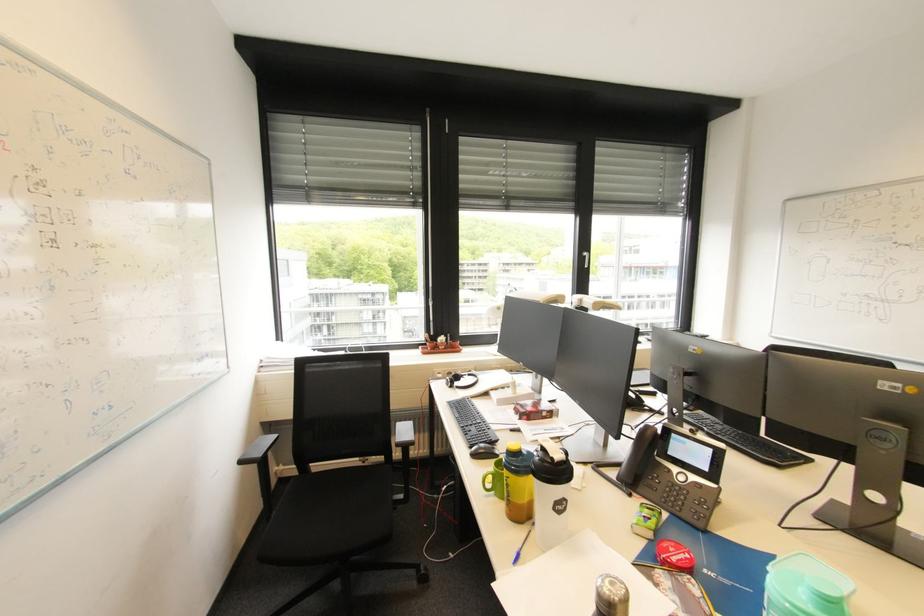
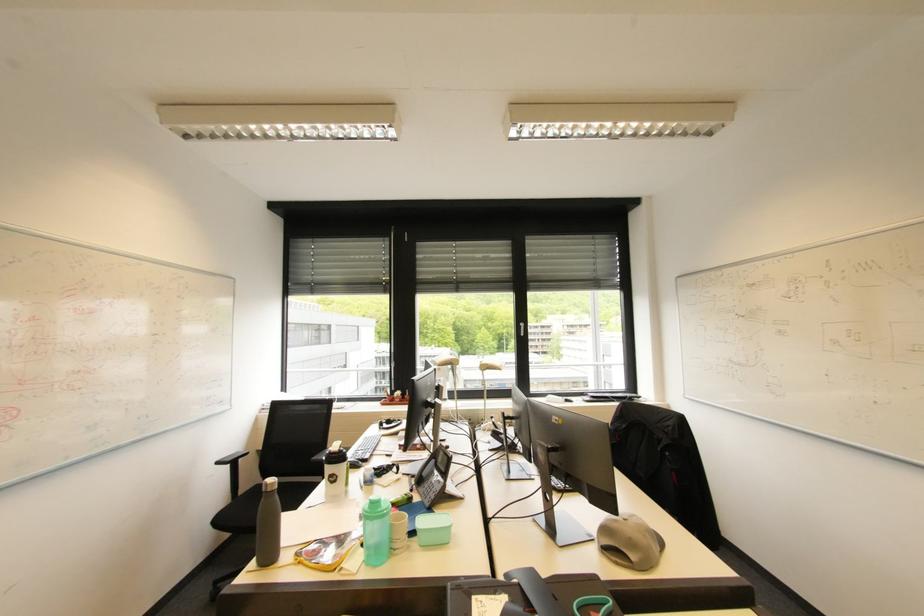
From the picture: Which direction would the cameraman need to move to produce the second image?

The cameraman walked toward right, backward.